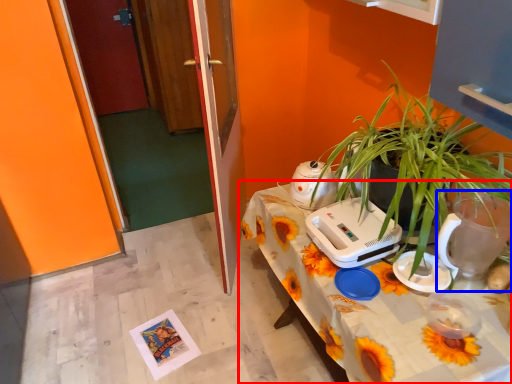
Question: Which object is further to the camera taking this photo, table (highlighted by a red box) or appliance (highlighted by a blue box)?

Choices:
 (A) table
 (B) appliance

Answer: (B)